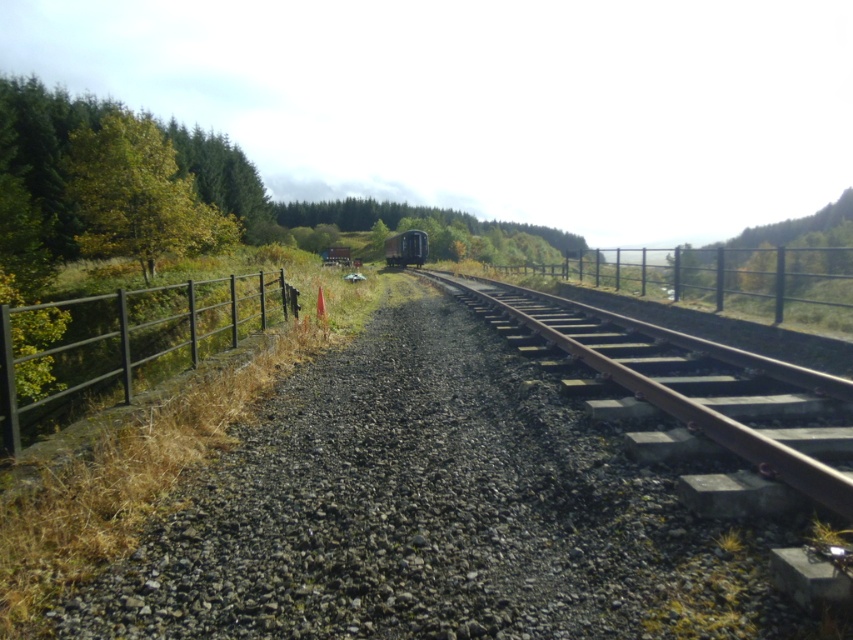
Question: Is metallic fence at right positioned before green matte train at center?

Choices:
 (A) no
 (B) yes

Answer: (B)

Question: Which object is positioned farthest from the rusty metal train track at center?

Choices:
 (A) green matte train at center
 (B) black metal fence at left

Answer: (A)

Question: In this image, where is metallic fence at right located relative to green matte tree at center?

Choices:
 (A) left
 (B) right

Answer: (B)

Question: Which point is closer to the camera taking this photo?

Choices:
 (A) (641, 292)
 (B) (798, 408)
 (C) (61, 125)

Answer: (B)

Question: Which point appears farthest from the camera in this image?

Choices:
 (A) (421, 232)
 (B) (250, 284)
 (C) (676, 294)

Answer: (A)

Question: Is rusty metal train track at center thinner than metallic fence at right?

Choices:
 (A) yes
 (B) no

Answer: (A)